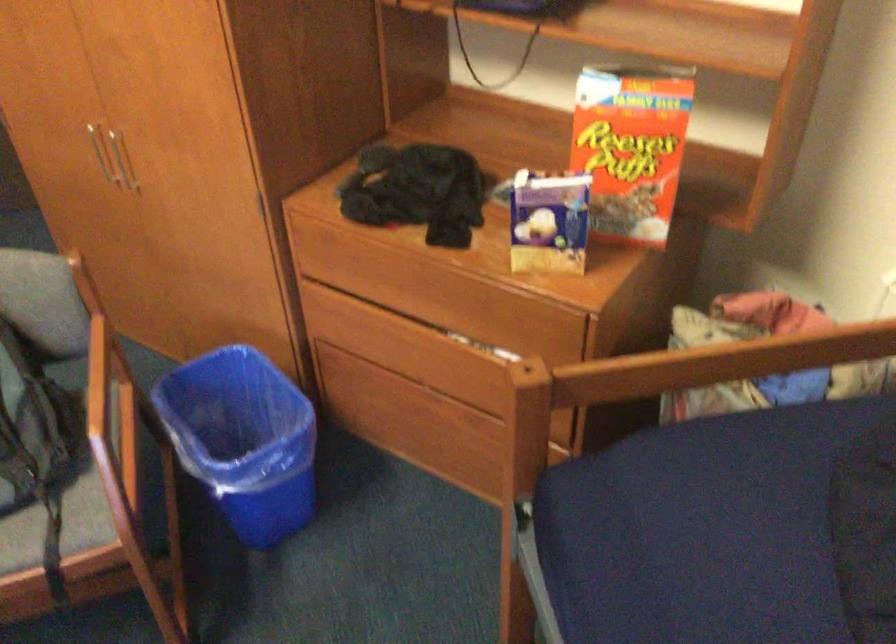
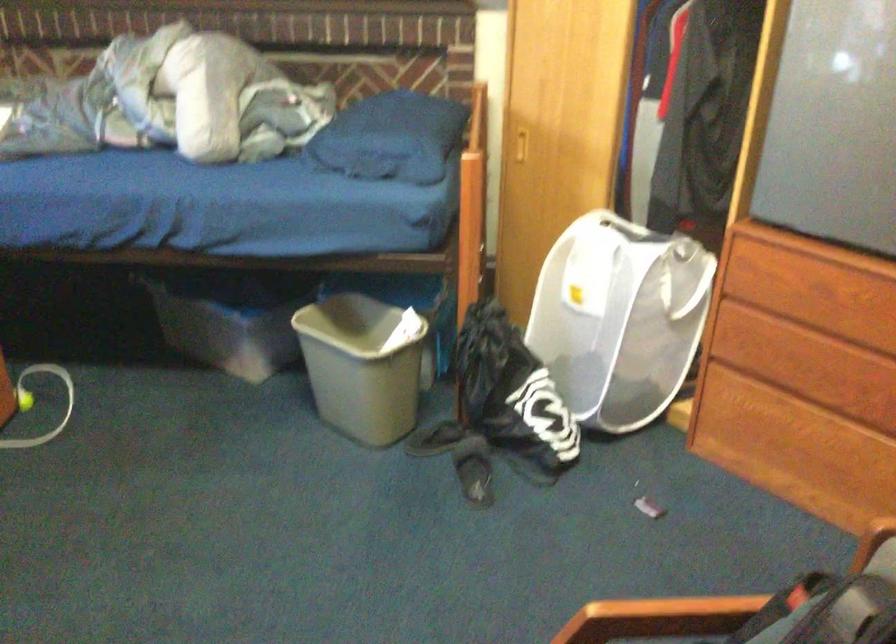
From the picture: Based on the continuous images, in which direction is the camera rotating?

The rotation direction of the camera is left-down.